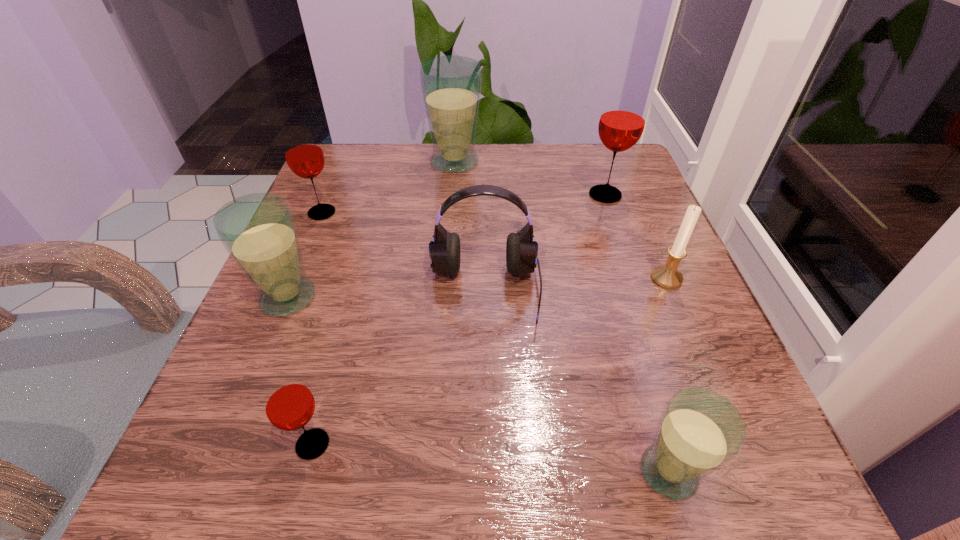
Find the location of a particular element. the farthest blue glass is located at coordinates click(451, 85).

This screenshot has width=960, height=540. What are the coordinates of `the farthest object` in the screenshot? It's located at (451, 85).

The image size is (960, 540). Find the location of `the rightmost red glass`. the rightmost red glass is located at coordinates (623, 117).

Identify the location of the leftmost red glass. The width and height of the screenshot is (960, 540). (303, 153).

Where is `the second biggest blue glass`? The height and width of the screenshot is (540, 960). the second biggest blue glass is located at coordinates (258, 230).

Locate an element on the screen. the second nearest blue glass is located at coordinates (258, 230).

You are a GUI agent. You are given a task and a screenshot of the screen. Output one action in this format:
    pyautogui.click(x=<x>, y=<y>)
    Task: Click on the headset
    Image resolution: width=960 pixels, height=540 pixels.
    Given the screenshot: What is the action you would take?
    pyautogui.click(x=521, y=251)

Locate an element on the screen. The image size is (960, 540). candle holder is located at coordinates (667, 276).

I want to click on the third glass from left to right, so click(x=289, y=405).

This screenshot has height=540, width=960. Identify the location of the third object from left to right. (289, 405).